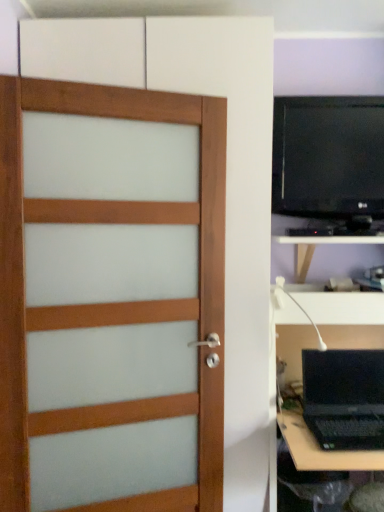
The image size is (384, 512). In order to click on satin wood door at left in this screenshot , I will do `click(111, 303)`.

Describe the element at coordinates (111, 303) in the screenshot. I see `satin wood door at left` at that location.

The height and width of the screenshot is (512, 384). In order to click on black glossy monitor at upper right in this screenshot , I will do `click(329, 164)`.

Where is `white matte tv cabinet at lower right`? white matte tv cabinet at lower right is located at coordinates (343, 308).

What is the approximate height of black plastic entertainment center at right?

The height of black plastic entertainment center at right is 3.88 feet.

The width and height of the screenshot is (384, 512). Identify the location of white plastic lamp at right. (297, 306).

What do you see at coordinates (344, 398) in the screenshot? Image resolution: width=384 pixels, height=512 pixels. I see `black matte laptop at lower right` at bounding box center [344, 398].

The image size is (384, 512). Identify the location of satin wood door at left. pyautogui.click(x=111, y=303).

Is black glossy monitor at upper right directly adjacent to white plastic lamp at right?

No, black glossy monitor at upper right is not in contact with white plastic lamp at right.

Where is `computer monitor behind the white plastic lamp at right`? computer monitor behind the white plastic lamp at right is located at coordinates (329, 164).

From a real-world perspective, does black glossy monitor at upper right stand above white plastic lamp at right?

Correct, in the physical world, black glossy monitor at upper right is higher than white plastic lamp at right.

Based on the photo, considering the positions of objects white matte tv cabinet at lower right and black plastic entertainment center at right in the image provided, who is behind, white matte tv cabinet at lower right or black plastic entertainment center at right?

white matte tv cabinet at lower right is behind.

Is white matte tv cabinet at lower right bigger than black plastic entertainment center at right?

Incorrect, white matte tv cabinet at lower right is not larger than black plastic entertainment center at right.

Is white matte tv cabinet at lower right outside of black plastic entertainment center at right?

Indeed, white matte tv cabinet at lower right is completely outside black plastic entertainment center at right.

Considering the points (339, 303) and (285, 166), which point is in front, point (339, 303) or point (285, 166)?

Positioned in front is point (339, 303).

Identify the location of computer monitor behind the white plastic lamp at right. The width and height of the screenshot is (384, 512). (329, 164).

What's the angular difference between white plastic lamp at right and black glossy monitor at upper right's facing directions?

There is a 0.7-degree angle between the facing directions of white plastic lamp at right and black glossy monitor at upper right.

Can you confirm if white plastic lamp at right is positioned to the left of black glossy monitor at upper right?

Yes, white plastic lamp at right is to the left of black glossy monitor at upper right.

How different are the orientations of white matte tv cabinet at lower right and black matte laptop at lower right in degrees?

They differ by 0.088 degrees in their facing directions.

You are a GUI agent. You are given a task and a screenshot of the screen. Output one action in this format:
    pyautogui.click(x=<x>, y=<y>)
    Task: Click on the laptop that is under the white matte tv cabinet at lower right (from a real-world perspective)
    The image size is (384, 512).
    Given the screenshot: What is the action you would take?
    pyautogui.click(x=344, y=398)

Is point (305, 303) closer or farther from the camera than point (329, 350)?

Point (305, 303) is closer to the camera than point (329, 350).

Does white matte tv cabinet at lower right turn towards black matte laptop at lower right?

No, white matte tv cabinet at lower right is not oriented towards black matte laptop at lower right.

From the image's perspective, which is above, black plastic entertainment center at right or white plastic lamp at right?

white plastic lamp at right is shown above in the image.

Based on the photo, is black plastic entertainment center at right far away from white plastic lamp at right?

No.

In the scene shown: Measure the distance between black plastic entertainment center at right and white plastic lamp at right.

black plastic entertainment center at right is 20.59 inches from white plastic lamp at right.

How far apart are white plastic lamp at right and satin wood door at left?

The distance of white plastic lamp at right from satin wood door at left is 30.28 inches.

From a real-world perspective, is white plastic lamp at right physically located above or below satin wood door at left?

white plastic lamp at right is above satin wood door at left.

From the image's perspective, who appears lower, white plastic lamp at right or satin wood door at left?

satin wood door at left appears lower in the image.

I want to click on door in front of the white plastic lamp at right, so click(111, 303).

Considering the relative sizes of white matte tv cabinet at lower right and satin wood door at left in the image provided, is white matte tv cabinet at lower right thinner than satin wood door at left?

In fact, white matte tv cabinet at lower right might be wider than satin wood door at left.

Is white matte tv cabinet at lower right aimed at satin wood door at left?

No, white matte tv cabinet at lower right is not aimed at satin wood door at left.

Which point is more distant from viewer, (368, 320) or (213, 163)?

Point (368, 320)

From a real-world perspective, which object stands above the other?

In real-world perspective, white matte tv cabinet at lower right is above.

Locate an element on the screen. computer monitor behind the white plastic lamp at right is located at coordinates (329, 164).

At what (x,y) coordinates should I click in order to perform the action: click on entertainment center located underneath the white matte tv cabinet at lower right (from a real-world perspective). Please return your answer as a coordinate pair (x, y). Image resolution: width=384 pixels, height=512 pixels. Looking at the image, I should click on (329, 169).

Looking at the image, which one is located further to satin wood door at left, black matte laptop at lower right or white matte tv cabinet at lower right?

Among the two, black matte laptop at lower right is located further to satin wood door at left.

When comparing their distances from black plastic entertainment center at right, does satin wood door at left or white plastic lamp at right seem further?

satin wood door at left.

When comparing their distances from white matte tv cabinet at lower right, does black plastic entertainment center at right or black matte laptop at lower right seem closer?

Based on the image, black plastic entertainment center at right appears to be nearer to white matte tv cabinet at lower right.

Estimate the real-world distances between objects in this image. Which object is further from black plastic entertainment center at right, black glossy monitor at upper right or satin wood door at left?

satin wood door at left.

When comparing their distances from white matte tv cabinet at lower right, does black glossy monitor at upper right or black plastic entertainment center at right seem closer?

black plastic entertainment center at right is positioned closer to the anchor white matte tv cabinet at lower right.

From the picture: Estimate the real-world distances between objects in this image. Which object is further from white plastic lamp at right, black matte laptop at lower right or white matte tv cabinet at lower right?

The object further to white plastic lamp at right is black matte laptop at lower right.

In the scene shown: Based on their spatial positions, is white plastic lamp at right or black glossy monitor at upper right further from white matte tv cabinet at lower right?

Among the two, black glossy monitor at upper right is located further to white matte tv cabinet at lower right.

Looking at the image, which one is located closer to black matte laptop at lower right, satin wood door at left or white matte tv cabinet at lower right?

Based on the image, white matte tv cabinet at lower right appears to be nearer to black matte laptop at lower right.

Locate an element on the screen. Image resolution: width=384 pixels, height=512 pixels. laptop between black glossy monitor at upper right and black plastic entertainment center at right from top to bottom is located at coordinates (344, 398).

Identify the location of door between black glossy monitor at upper right and black plastic entertainment center at right in the vertical direction. (111, 303).

I want to click on tv cabinet between black glossy monitor at upper right and black plastic entertainment center at right in the up-down direction, so click(x=343, y=308).

Where is `lamp between black glossy monitor at upper right and black plastic entertainment center at right from top to bottom`? The width and height of the screenshot is (384, 512). lamp between black glossy monitor at upper right and black plastic entertainment center at right from top to bottom is located at coordinates (297, 306).